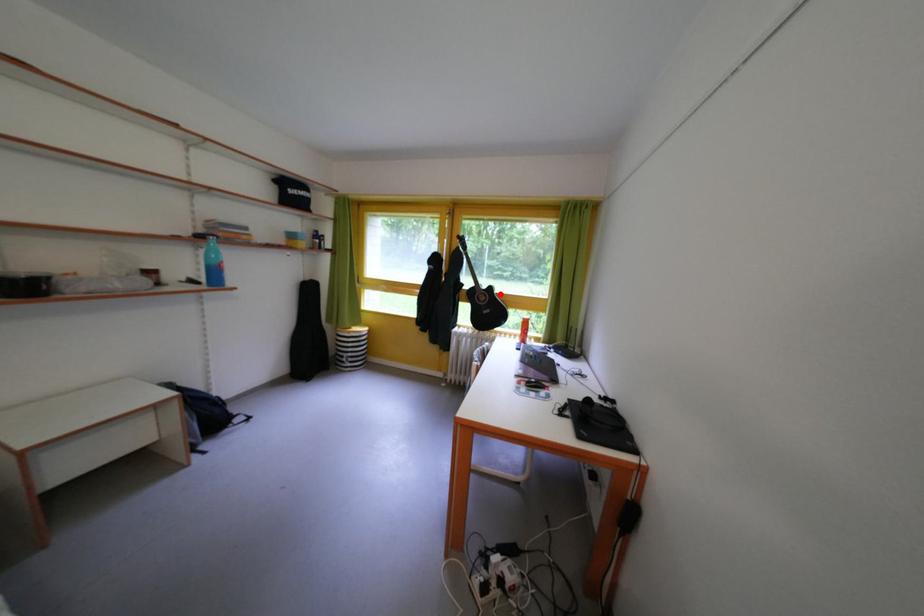
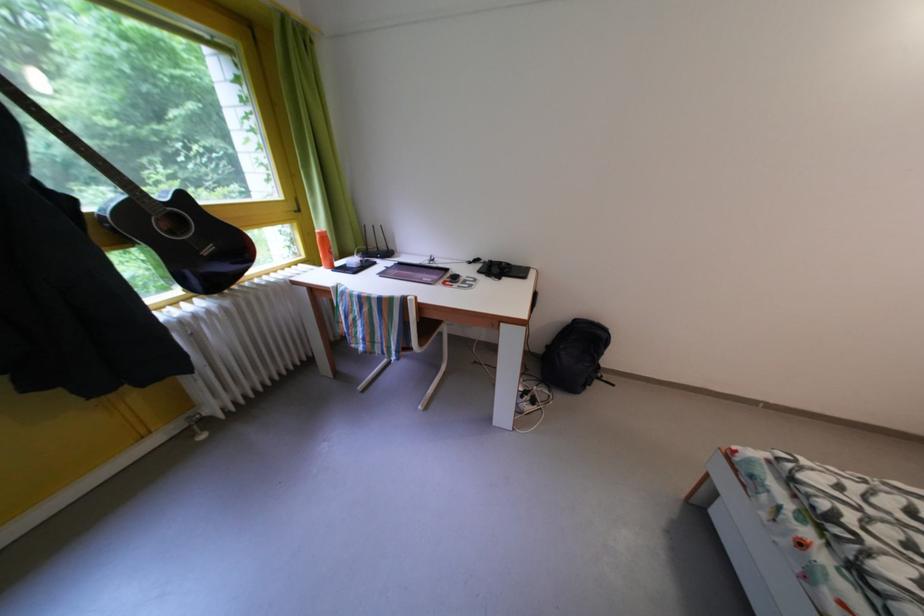
Find the pixel in the second image that matches the highlighted location in the first image.

(191, 203)